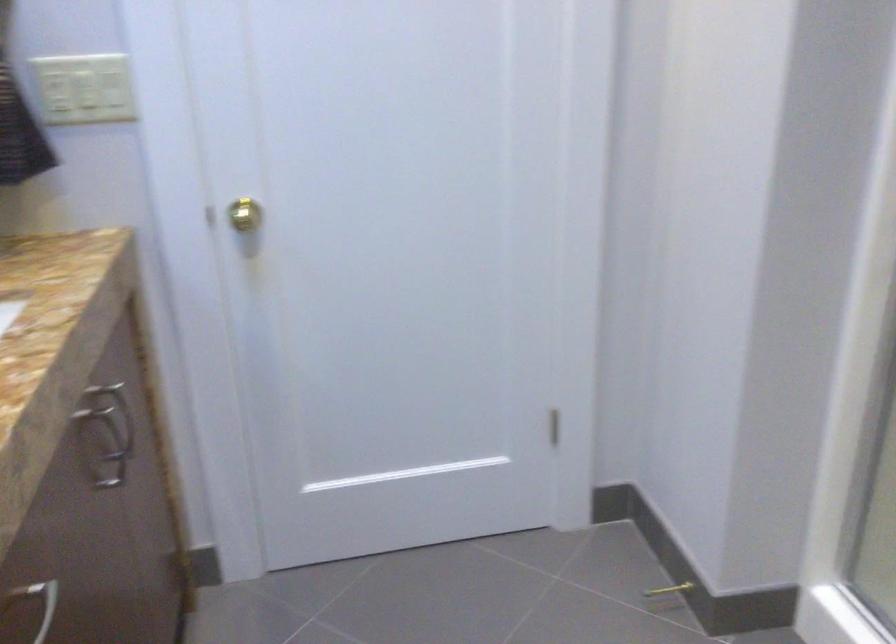
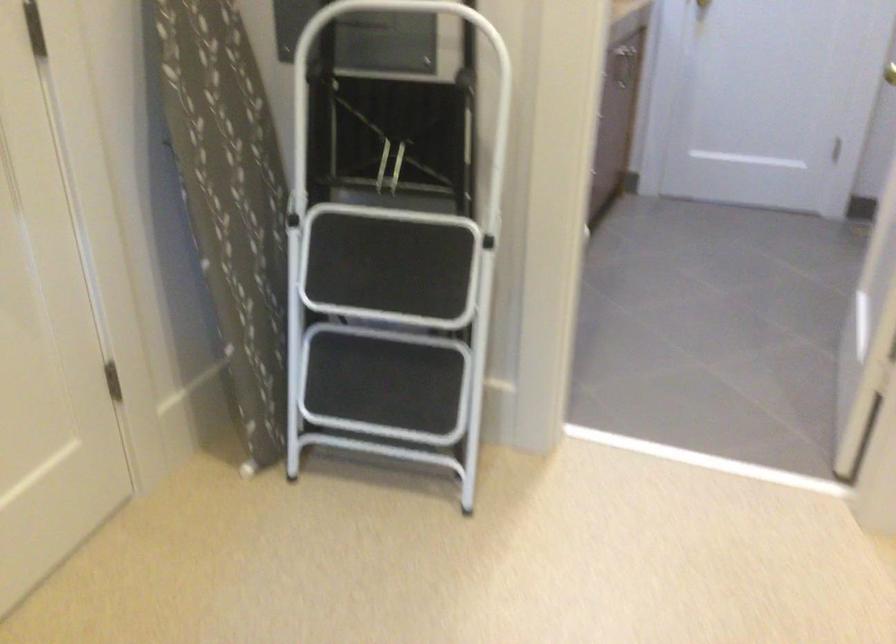
Locate, in the second image, the point that corresponds to the point at 590,306 in the first image.

(890, 73)